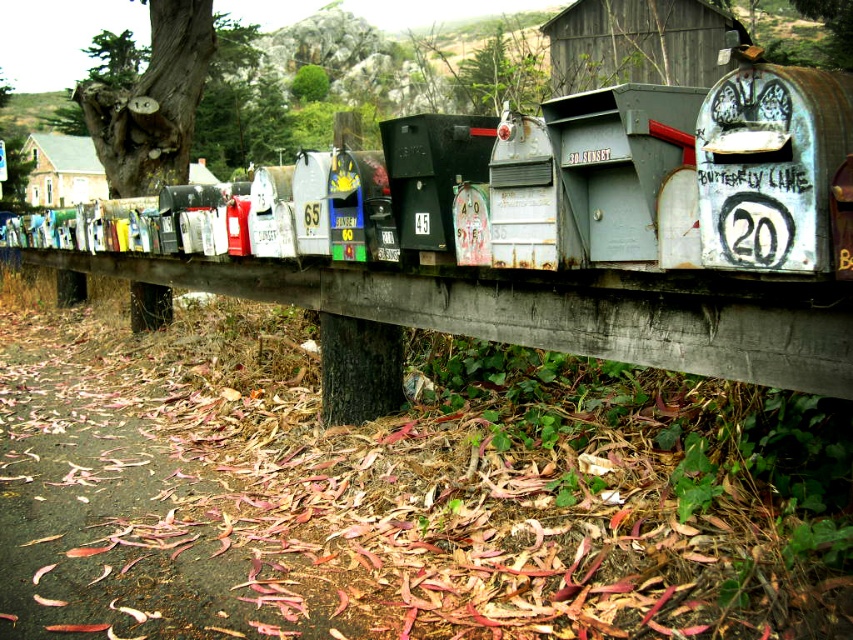
Question: Which of the following is the closest to the observer?

Choices:
 (A) rusty metal mailbox at center
 (B) matte black mailbox at center
 (C) rusty metal mailbox at center-right
 (D) wooden rail at center

Answer: (C)

Question: Is rusty metal mailbox at center-right behind matte black mailbox at center?

Choices:
 (A) yes
 (B) no

Answer: (B)

Question: Which object is positioned closest to the rusty metal mailbox at center-right?

Choices:
 (A) rusty metal mailbox at center
 (B) wooden rail at center

Answer: (A)

Question: Does rusty metal mailbox at center-right have a lesser width compared to matte black mailbox at center?

Choices:
 (A) yes
 (B) no

Answer: (A)

Question: Which of the following is the farthest from the observer?

Choices:
 (A) pyautogui.click(x=398, y=195)
 (B) pyautogui.click(x=799, y=106)
 (C) pyautogui.click(x=729, y=280)

Answer: (A)

Question: In this image, where is wooden rail at center located relative to rusty metal mailbox at center?

Choices:
 (A) left
 (B) right

Answer: (A)